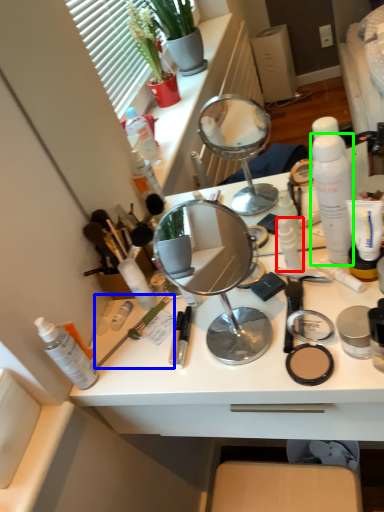
Question: Based on their relative distances, which object is nearer to toiletry (highlighted by a red box)? Choose from brush (highlighted by a blue box) and toiletry (highlighted by a green box).

Choices:
 (A) brush
 (B) toiletry

Answer: (B)